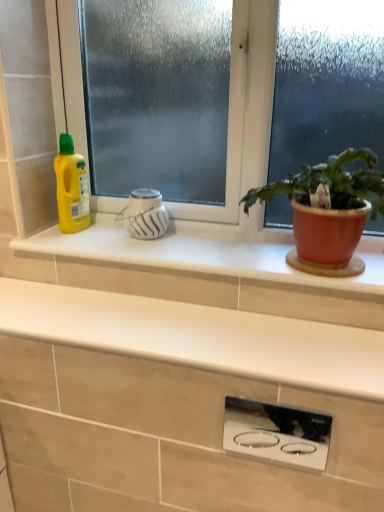
Identify the location of vacant space that is to the left of white glossy vase at center, which ranks as the 1th appliance in left-to-right order. The width and height of the screenshot is (384, 512). (85, 238).